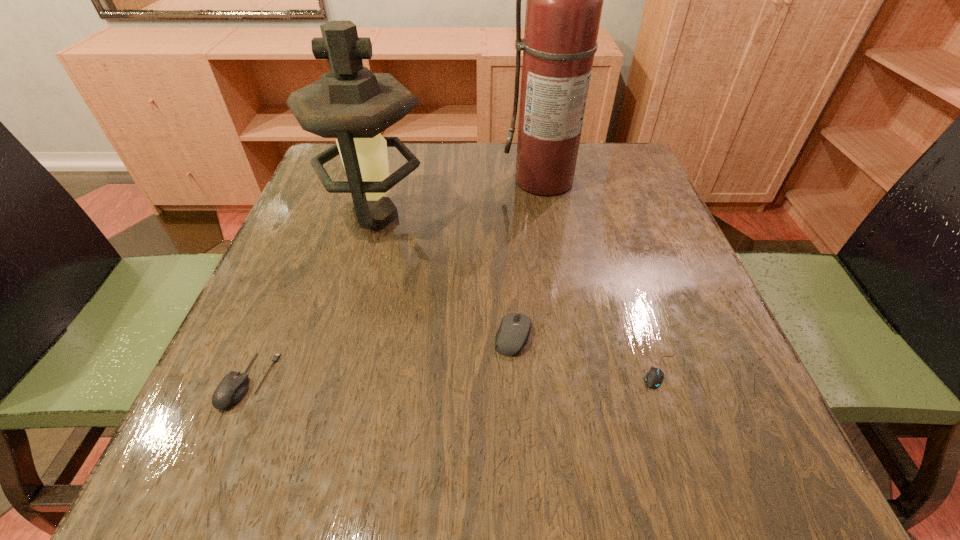
The width and height of the screenshot is (960, 540). In order to click on mouse that stands as the closest to the fourth tallest object in this screenshot , I will do `click(514, 330)`.

The image size is (960, 540). Identify the location of free location that satisfies the following two spatial constraints: 1. on the front side of the tallest mouse; 2. on the left side of the rightmost mouse. (516, 369).

Identify the location of vacant space that satisfies the following two spatial constraints: 1. on the back side of the second shortest object; 2. on the left side of the second tallest object. (319, 217).

Locate an element on the screen. This screenshot has width=960, height=540. vacant space that satisfies the following two spatial constraints: 1. on the front-facing side of the shortest mouse; 2. on the left side of the tallest object is located at coordinates (581, 369).

This screenshot has height=540, width=960. I want to click on free region that satisfies the following two spatial constraints: 1. on the front-facing side of the shortest object; 2. on the left side of the fire extinguisher, so click(x=581, y=369).

I want to click on vacant position in the image that satisfies the following two spatial constraints: 1. on the front side of the tallest mouse; 2. on the right side of the rightmost mouse, so click(516, 369).

Find the location of `free space that satisfies the following two spatial constraints: 1. on the front-facing side of the shortest object; 2. on the left side of the fire extinguisher`. free space that satisfies the following two spatial constraints: 1. on the front-facing side of the shortest object; 2. on the left side of the fire extinguisher is located at coordinates (581, 369).